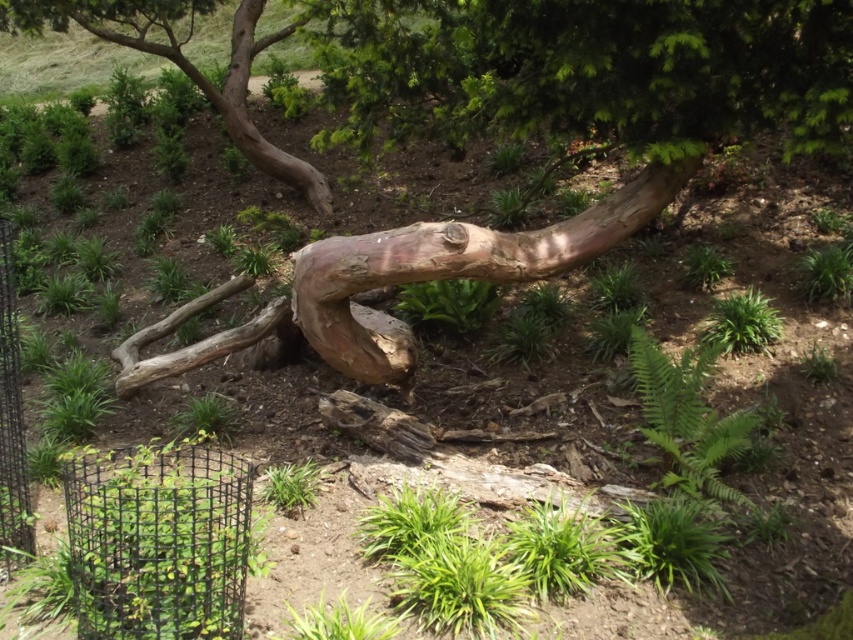
You are a landscape designer planning to place a new garden sculpture. You have two options based on the image. The first option is to place it near the natural wood tree trunk at center, and the second is near the brown rough bark tree at upper left. Which location would allow more space for the sculpture?

The brown rough bark tree at upper left occupies more space than the natural wood tree trunk at center, so placing the sculpture near the natural wood tree trunk at center would allow more space for the sculpture.

You are a hiker who wants to take a photo of the natural wood tree trunk at center and the black wire fence at lower left. Which object should you move towards if you want to capture both in a single frame without moving the camera?

You should move towards the black wire fence at lower left because the natural wood tree trunk at center is to the right of it, so positioning yourself closer to the fence will allow both objects to be within the camera frame.